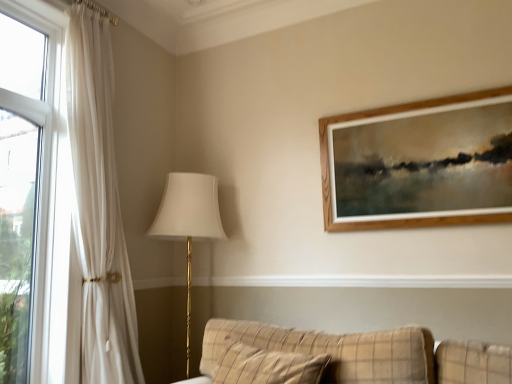
Describe the element at coordinates (365, 281) in the screenshot. I see `white smooth baseboard at lower center` at that location.

Locate an element on the screen. This screenshot has width=512, height=384. white smooth baseboard at lower center is located at coordinates (365, 281).

This screenshot has width=512, height=384. What are the coordinates of `white smooth baseboard at lower center` in the screenshot? It's located at (365, 281).